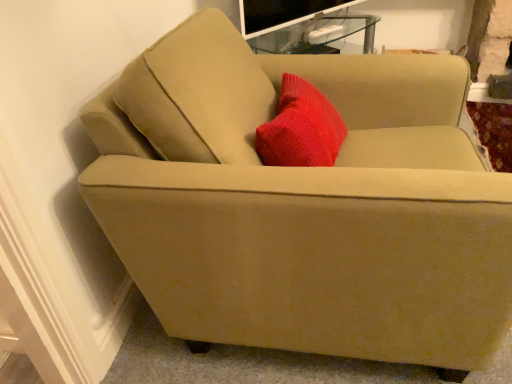
This screenshot has height=384, width=512. What do you see at coordinates (317, 35) in the screenshot? I see `transparent glass table at upper center` at bounding box center [317, 35].

Measure the distance between transparent glass table at upper center and camera.

transparent glass table at upper center is 1.77 meters away from camera.

Measure the distance between point (362, 20) and camera.

Point (362, 20) is 6.87 feet from camera.

Where is `transparent glass table at upper center`? The height and width of the screenshot is (384, 512). transparent glass table at upper center is located at coordinates (317, 35).

This screenshot has width=512, height=384. Identify the location of transparent glass table at upper center. (317, 35).